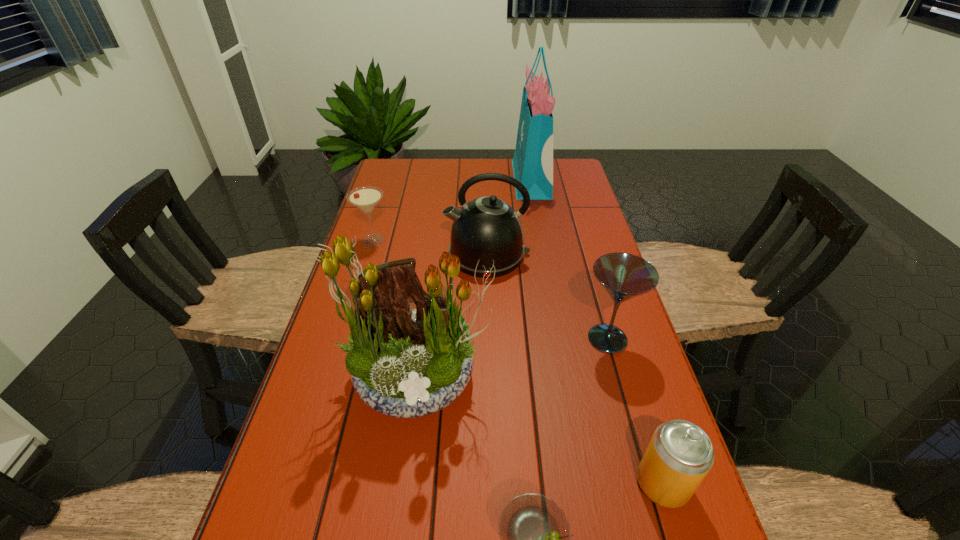
Where is `the tallest object`? Image resolution: width=960 pixels, height=540 pixels. the tallest object is located at coordinates (532, 163).

What are the coordinates of `shopping bag` in the screenshot? It's located at (532, 163).

You are a GUI agent. You are given a task and a screenshot of the screen. Output one action in this format:
    pyautogui.click(x=<x>, y=<y>)
    Task: Click on the second tallest object
    This screenshot has height=540, width=960.
    Given the screenshot: What is the action you would take?
    pyautogui.click(x=406, y=364)

The height and width of the screenshot is (540, 960). I want to click on kettle, so (485, 229).

This screenshot has height=540, width=960. In order to click on the fourth shortest object in this screenshot , I will do `click(624, 276)`.

At what (x,y) coordinates should I click in order to perform the action: click on the second farthest martini. Please return your answer as a coordinate pair (x, y). This screenshot has width=960, height=540. Looking at the image, I should click on (624, 276).

The image size is (960, 540). What are the coordinates of `the farthest martini` in the screenshot? It's located at (366, 198).

Locate an element on the screen. This screenshot has height=540, width=960. the second nearest object is located at coordinates (680, 454).

This screenshot has width=960, height=540. What are the coordinates of `vacant space located 0.240m on the front of the shopping bag` in the screenshot? It's located at (542, 243).

Where is `vacant space located 0.120m on the front-facing side of the flower arrangement`? Image resolution: width=960 pixels, height=540 pixels. vacant space located 0.120m on the front-facing side of the flower arrangement is located at coordinates (403, 491).